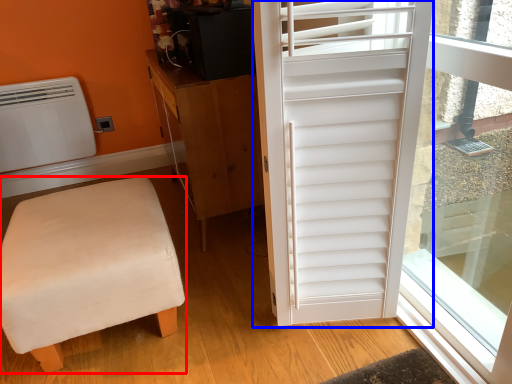
Question: Which point is further to the camera, furniture (highlighted by a red box) or door (highlighted by a blue box)?

Choices:
 (A) furniture
 (B) door

Answer: (A)